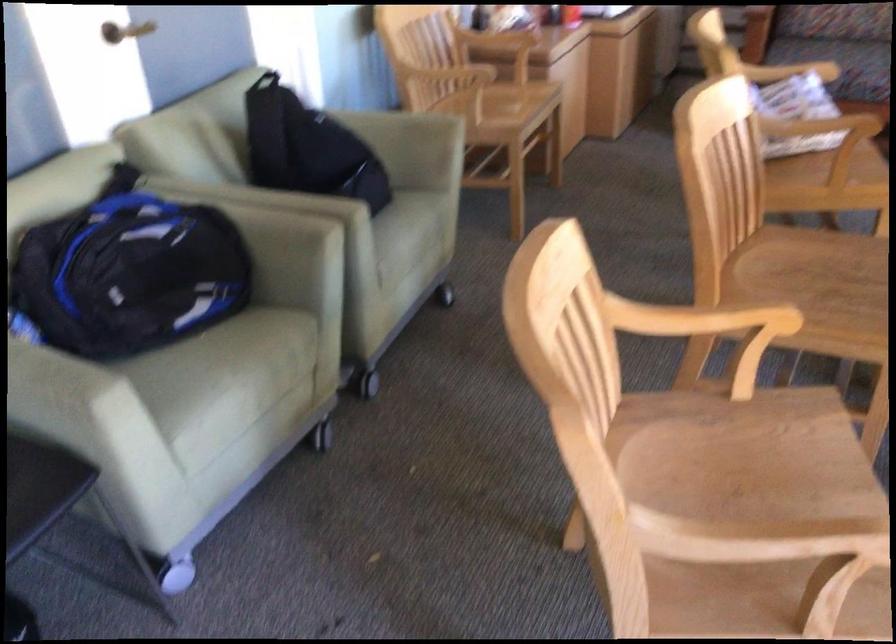
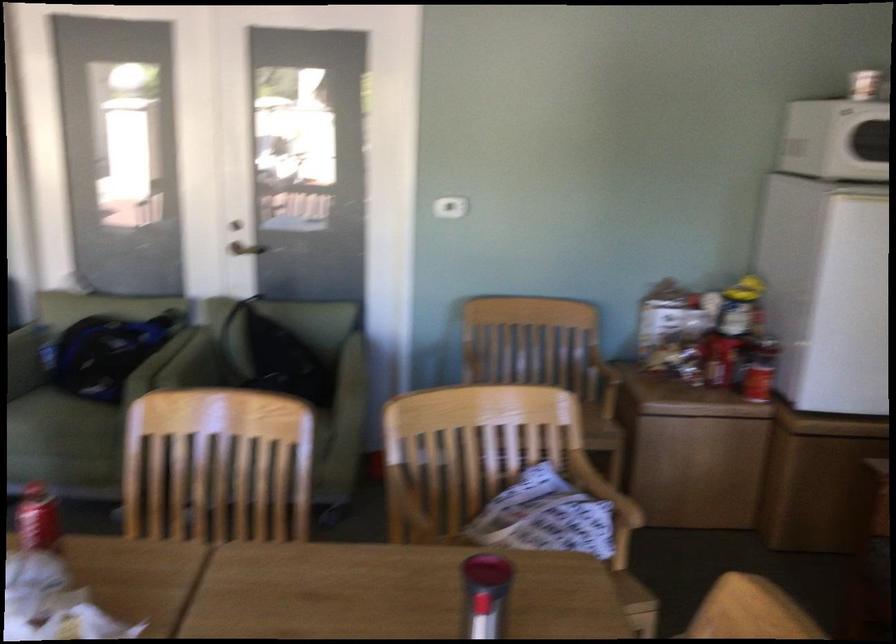
Question: I am providing you with two images of the same scene from different viewpoints. After the viewpoint changes to image2, which objects are now occluded?

Choices:
 (A) chair sitting surface
 (B) red beverage can
 (C) white blind cord
 (D) sofa armrest

Answer: (A)